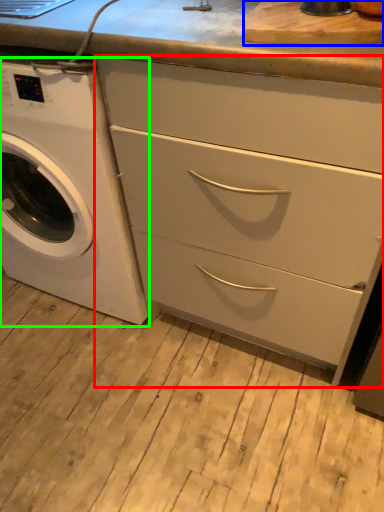
Question: Which is farther away from chest of drawers (highlighted by a red box)? cutting board (highlighted by a blue box) or washing machine (highlighted by a green box)?

Choices:
 (A) cutting board
 (B) washing machine

Answer: (A)